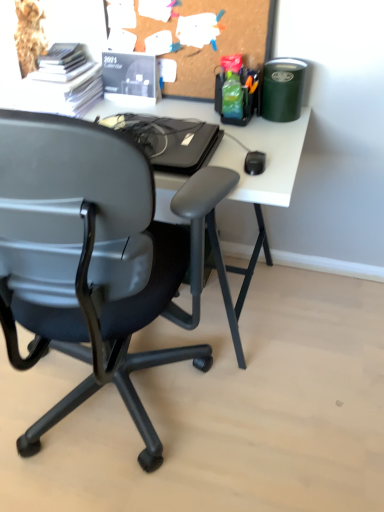
You are a GUI agent. You are given a task and a screenshot of the screen. Output one action in this format:
    pyautogui.click(x=<x>, y=<y>)
    Task: Click on the space that is in front of green matte trash can at upper right, the 4th stationery in the left-to-right sequence
    The image size is (384, 512).
    Given the screenshot: What is the action you would take?
    pyautogui.click(x=275, y=132)